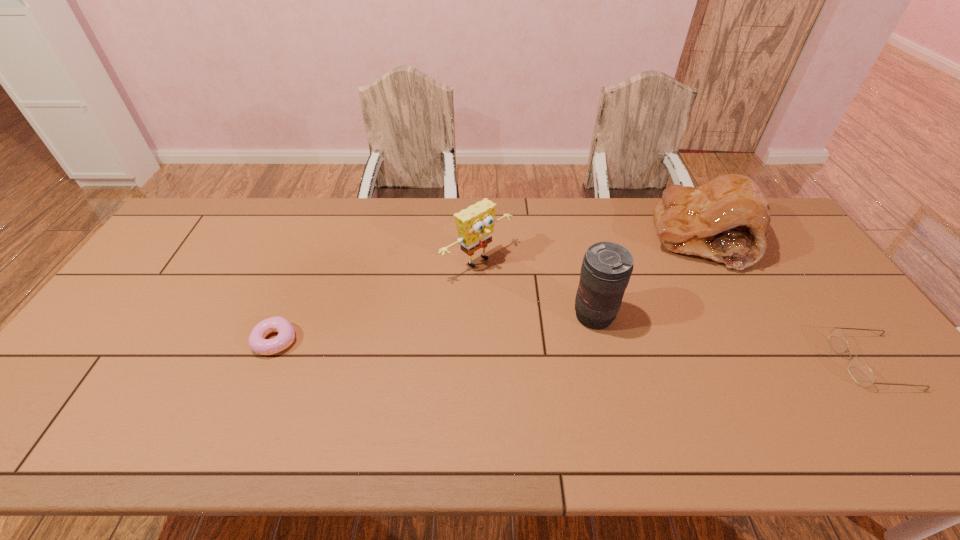
The height and width of the screenshot is (540, 960). I want to click on object that is at the near edge, so click(860, 372).

The image size is (960, 540). Identify the location of spectacles that is at the right edge. click(860, 372).

Identify the location of bread situated at the right edge. (727, 219).

What are the coordinates of `object situated at the far right corner` in the screenshot? It's located at (727, 219).

Locate an element on the screen. This screenshot has width=960, height=540. object at the near right corner is located at coordinates (860, 372).

The height and width of the screenshot is (540, 960). Find the location of `vacant space at the far edge of the desktop`. vacant space at the far edge of the desktop is located at coordinates (539, 220).

Locate an element on the screen. The height and width of the screenshot is (540, 960). vacant space at the near edge of the desktop is located at coordinates (537, 409).

Identify the location of vacant region at the left edge. (171, 278).

At what (x,y) coordinates should I click in order to perform the action: click on vacant region at the far left corner of the desktop. Please return your answer as a coordinate pair (x, y). Looking at the image, I should click on (180, 224).

Where is `vacant space at the near left corner of the desktop`? vacant space at the near left corner of the desktop is located at coordinates (43, 410).